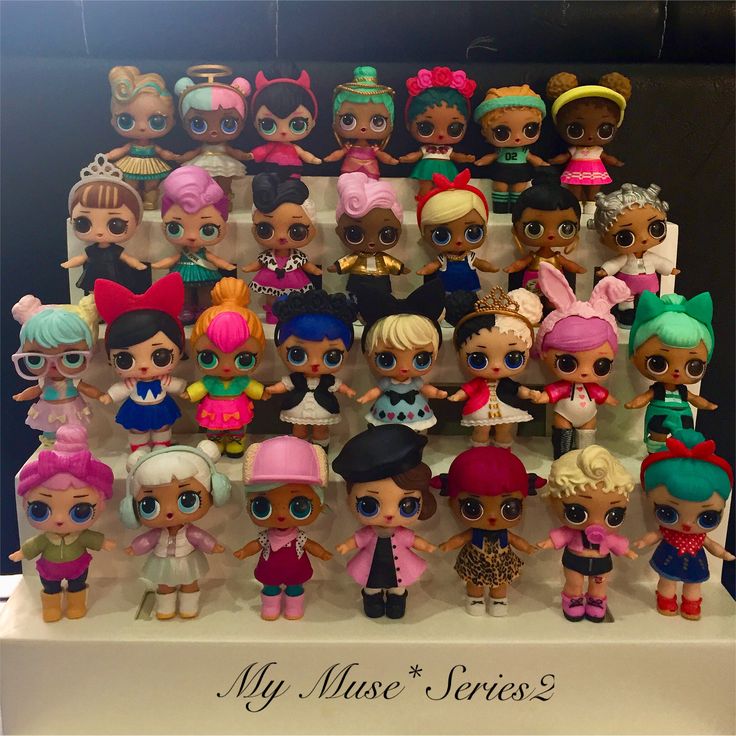
Where is `dolls with pink hair`? This screenshot has width=736, height=736. dolls with pink hair is located at coordinates (63, 556), (576, 400), (227, 382), (191, 261), (369, 240), (219, 107).